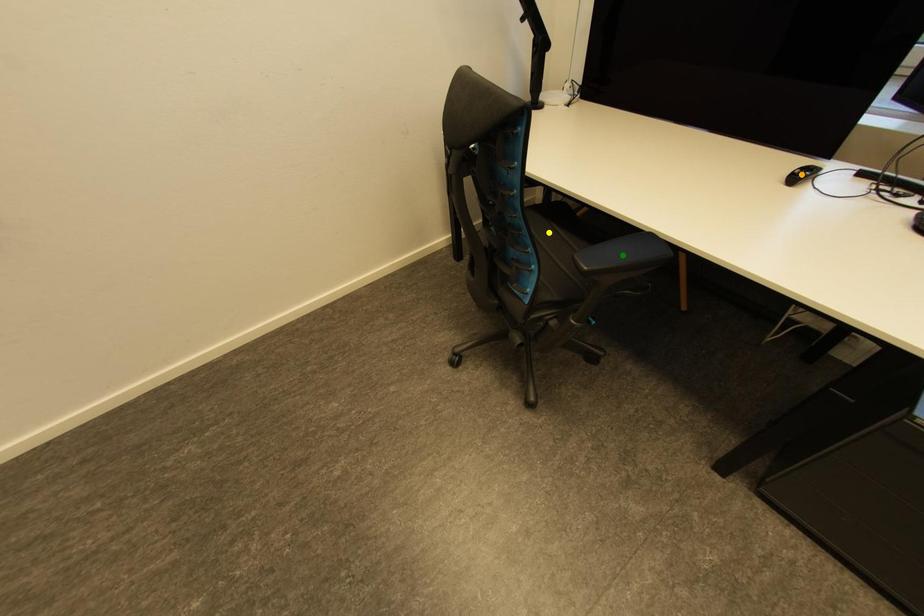
Order these from farthest to nearest:
A) orange point
B) yellow point
C) green point

orange point, yellow point, green point